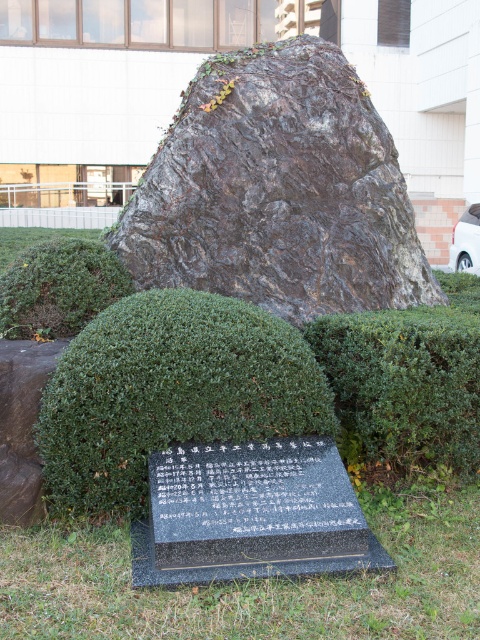
Between point (407, 353) and point (35, 301), which one is positioned behind?

Point (35, 301)

Between green leafy hedge at center and green leafy hedge at lower left, which one is positioned higher?

green leafy hedge at lower left is above.

Describe the element at coordinates (407, 381) in the screenshot. I see `green leafy hedge at center` at that location.

This screenshot has width=480, height=640. Identify the location of green leafy hedge at center. (407, 381).

Who is lower down, dark brown rock at center or green leafy hedge at lower left?

green leafy hedge at lower left is lower down.

Which is more to the right, dark brown rock at center or green leafy hedge at lower left?

dark brown rock at center

Which is in front, point (324, 113) or point (37, 301)?

Point (37, 301)

Locate an element on the screen. The image size is (480, 640). dark brown rock at center is located at coordinates (277, 189).

Who is higher up, green grass at lower center or green leafy hedge at center?

Positioned higher is green leafy hedge at center.

Can you confirm if green grass at lower center is positioned to the right of green leafy hedge at center?

In fact, green grass at lower center is to the left of green leafy hedge at center.

Locate an element on the screen. The width and height of the screenshot is (480, 640). green grass at lower center is located at coordinates (252, 582).